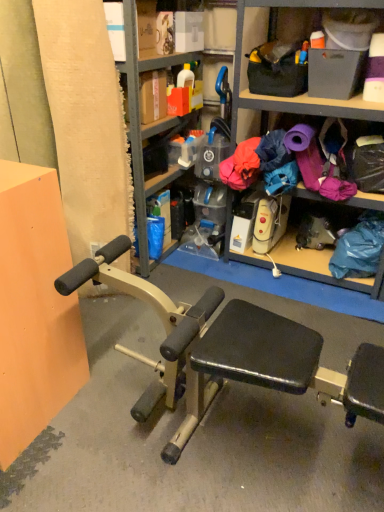
Question: From a real-world perspective, is purple fabric at center over metallic gray bookshelf at upper center?

Choices:
 (A) yes
 (B) no

Answer: (B)

Question: Is purple fabric at center bigger than metallic gray bookshelf at upper center?

Choices:
 (A) yes
 (B) no

Answer: (B)

Question: Does purple fabric at center have a lesser height compared to metallic gray bookshelf at upper center?

Choices:
 (A) yes
 (B) no

Answer: (A)

Question: Is purple fabric at center in front of metallic gray bookshelf at upper center?

Choices:
 (A) no
 (B) yes

Answer: (A)

Question: Is the depth of purple fabric at center greater than that of metallic gray bookshelf at upper center?

Choices:
 (A) no
 (B) yes

Answer: (B)

Question: Is purple fabric at center facing towards metallic gray bookshelf at upper center?

Choices:
 (A) yes
 (B) no

Answer: (B)

Question: Is purple fabric at center surrounded by metallic gray bookshelf at upper center?

Choices:
 (A) yes
 (B) no

Answer: (B)

Question: Could you tell me if metallic gray bookshelf at upper center is facing purple fabric at center?

Choices:
 (A) no
 (B) yes

Answer: (B)

Question: From the image's perspective, is metallic gray bookshelf at upper center above purple fabric at center?

Choices:
 (A) yes
 (B) no

Answer: (A)

Question: Is the depth of metallic gray bookshelf at upper center less than that of purple fabric at center?

Choices:
 (A) no
 (B) yes

Answer: (B)

Question: Is metallic gray bookshelf at upper center positioned behind purple fabric at center?

Choices:
 (A) yes
 (B) no

Answer: (B)

Question: From a real-world perspective, is metallic gray bookshelf at upper center over purple fabric at center?

Choices:
 (A) no
 (B) yes

Answer: (B)

Question: Based on their positions, is metallic gray bookshelf at upper center located to the left or right of purple fabric at center?

Choices:
 (A) left
 (B) right

Answer: (A)